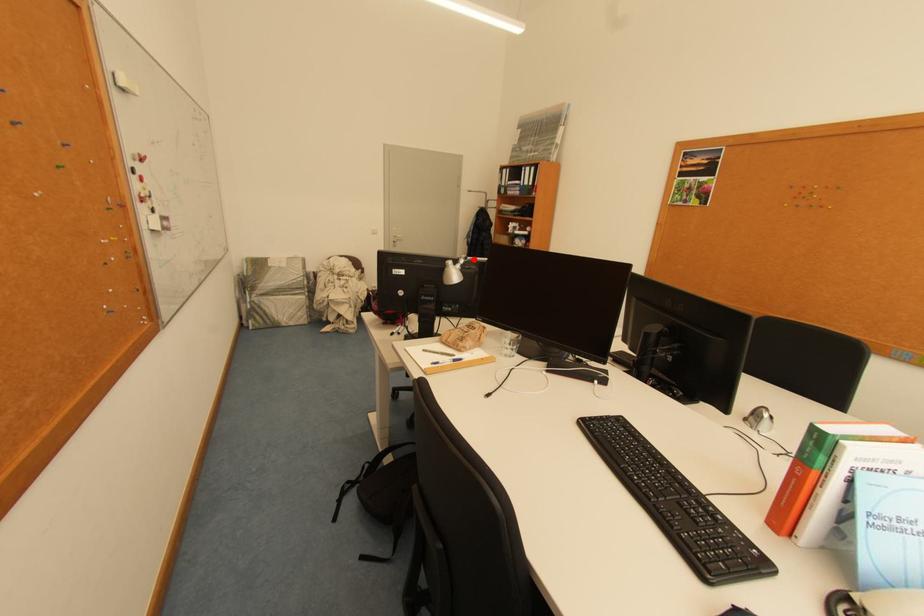
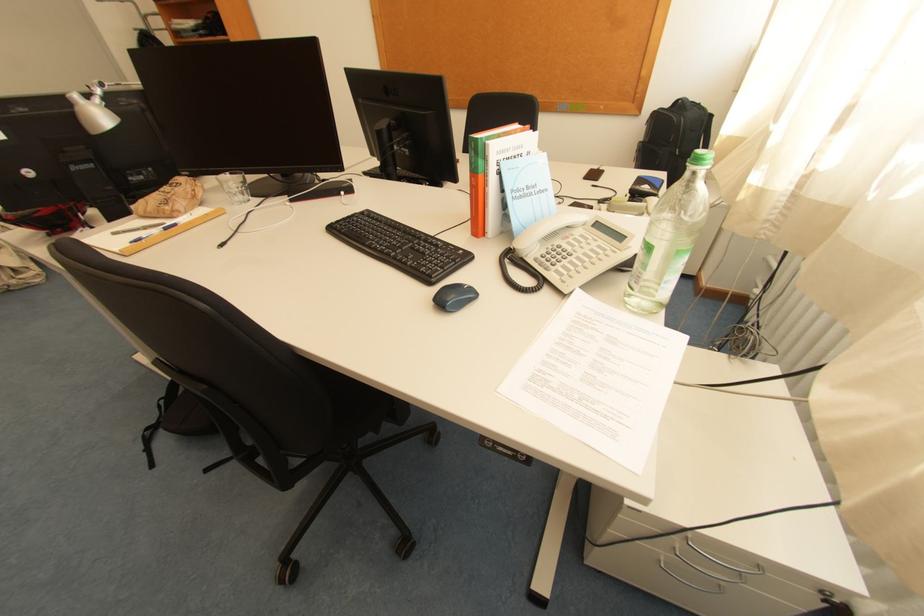
Where in the second image is the point corresponding to the highlighted location from the first image?

(110, 86)